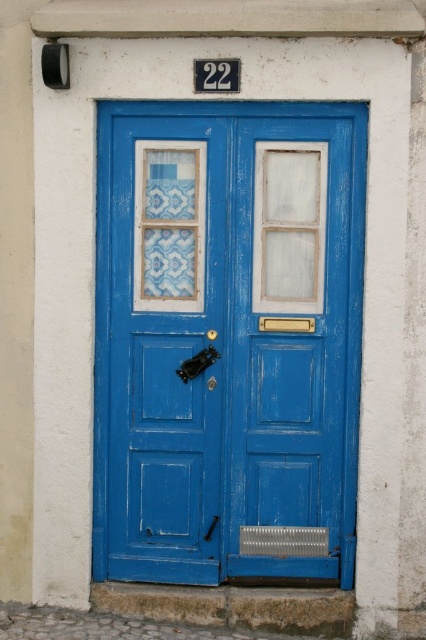
Question: Does blue painted wood door at center have a lesser width compared to white frosted glass at center?

Choices:
 (A) no
 (B) yes

Answer: (A)

Question: Among these points, which one is nearest to the camera?

Choices:
 (A) coord(155,308)
 (B) coord(305,216)

Answer: (B)

Question: Is blue painted wood door at center thinner than white frosted glass at center?

Choices:
 (A) no
 (B) yes

Answer: (A)

Question: Does blue painted wood door at center appear on the left side of white frosted glass at center?

Choices:
 (A) no
 (B) yes

Answer: (B)

Question: Which point appears closest to the camera in this image?

Choices:
 (A) (265, 301)
 (B) (192, 256)

Answer: (A)